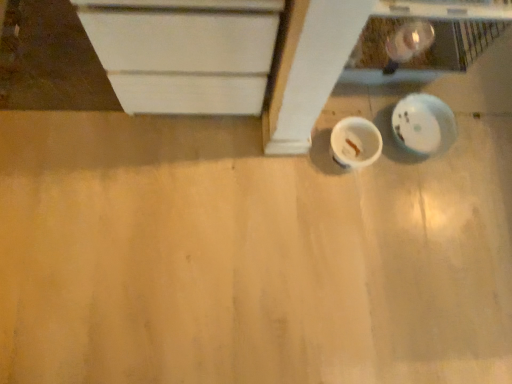
Find the location of a particular element. free point behind white glossy plate at lower right is located at coordinates (436, 89).